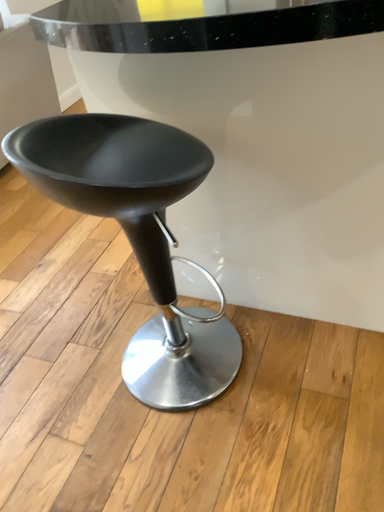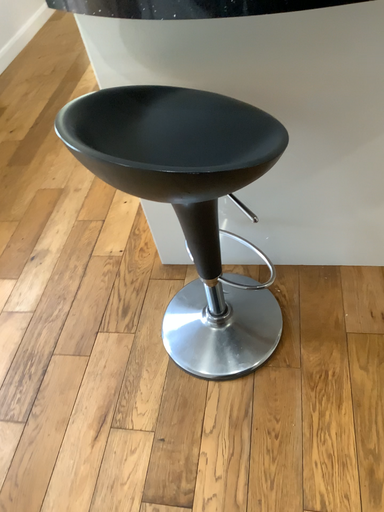
Question: Which way did the camera rotate in the video?

Choices:
 (A) rotated right
 (B) rotated left

Answer: (A)